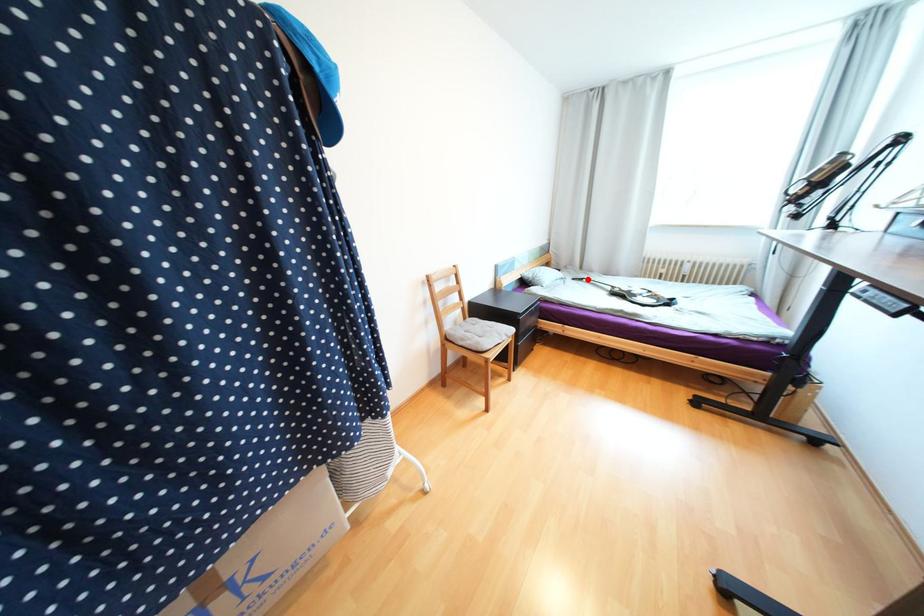
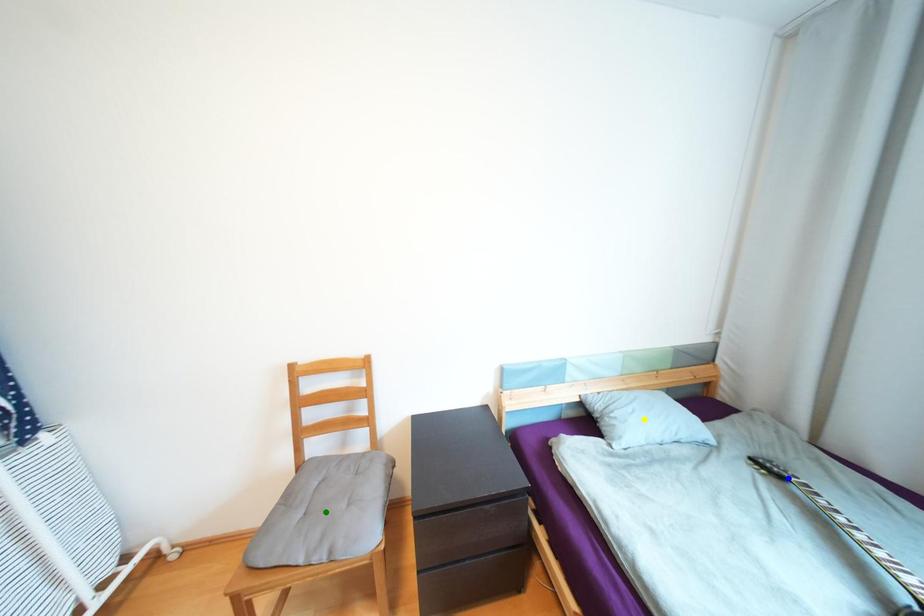
Question: I am providing you with two images of the same scene from different viewpoints. A red point is marked on the first image. You are given multiple points on the second image. Can you choose the point in image 2 that corresponds to the point in image 1?

Choices:
 (A) blue point
 (B) green point
 (C) yellow point

Answer: (A)